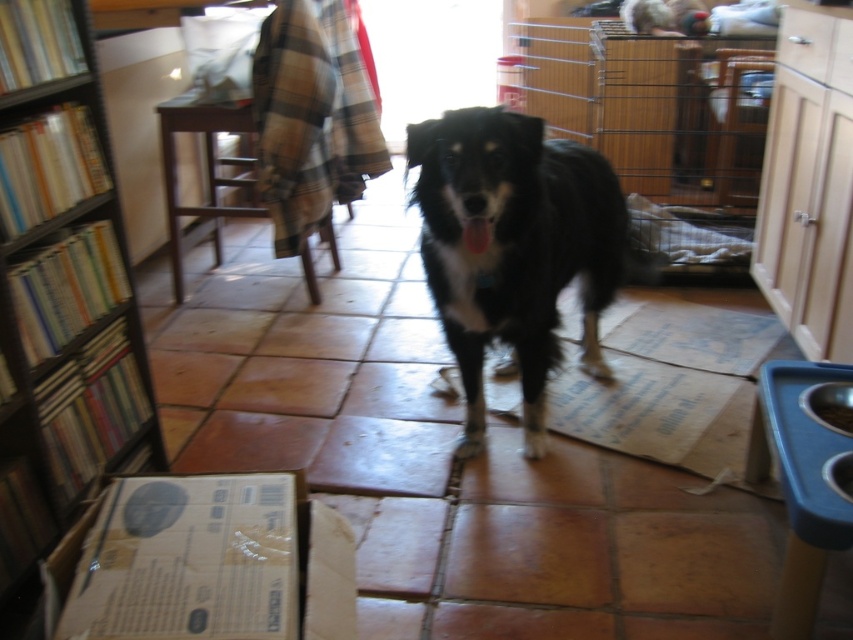
Question: Which point is farther to the camera?

Choices:
 (A) (61, 124)
 (B) (247, 548)
 (C) (480, 364)

Answer: (C)

Question: Is brown wooden bookcase at left closer to camera compared to black fur dog at center?

Choices:
 (A) no
 (B) yes

Answer: (B)

Question: Can you confirm if brown wooden bookcase at left is smaller than brown cardboard box at lower left?

Choices:
 (A) yes
 (B) no

Answer: (B)

Question: Is brown wooden bookcase at left above black fur dog at center?

Choices:
 (A) no
 (B) yes

Answer: (A)

Question: Which is nearer to the brown cardboard box at lower left?

Choices:
 (A) brown wooden bookcase at left
 (B) black fur dog at center

Answer: (A)

Question: Among these objects, which one is nearest to the camera?

Choices:
 (A) black fur dog at center
 (B) brown wooden bookcase at left

Answer: (B)